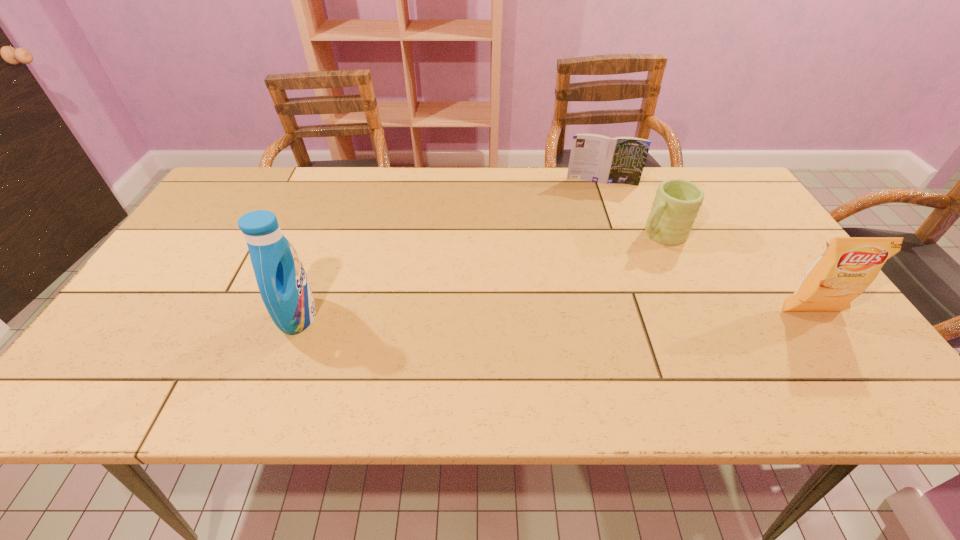
Locate an element on the screen. The height and width of the screenshot is (540, 960). vacant space on the desktop that is between the leftmost object and the second tallest object and is positioned on the side of the third nearest object with the handle is located at coordinates (521, 314).

This screenshot has height=540, width=960. Identify the location of free space on the desktop that is between the detergent and the crisp (potato chip) and is positioned on the front cover of the farthest object. (605, 313).